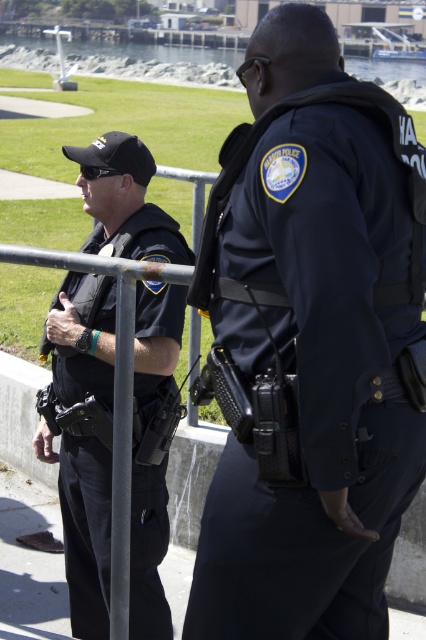
You are a tourist visiting the waterfront park and see the black matte uniform at center and the metallic gray pole at center. Which object takes up more space in the image?

The black matte uniform at center is bigger than the metallic gray pole at center, so it takes up more space in the image.

You are a pedestrian approaching the waterfront park and notice an officer in a dark blue uniform at center. Based on the coordinates provided, can you determine if the officer is positioned closer to the railing or further away from it?

The dark blue uniform at center is located at point coordinates, but without knowing the coordinate system or reference points related to the railing, it is impossible to determine the exact distance or position relative to the railing. The coordinates alone do not provide enough information about spatial relationships to the railing.

Based on the scene description, where is the dark blue uniform at center located in terms of its 2D coordinates?

The dark blue uniform at center is located at the 2D coordinates point (x=310, y=346).